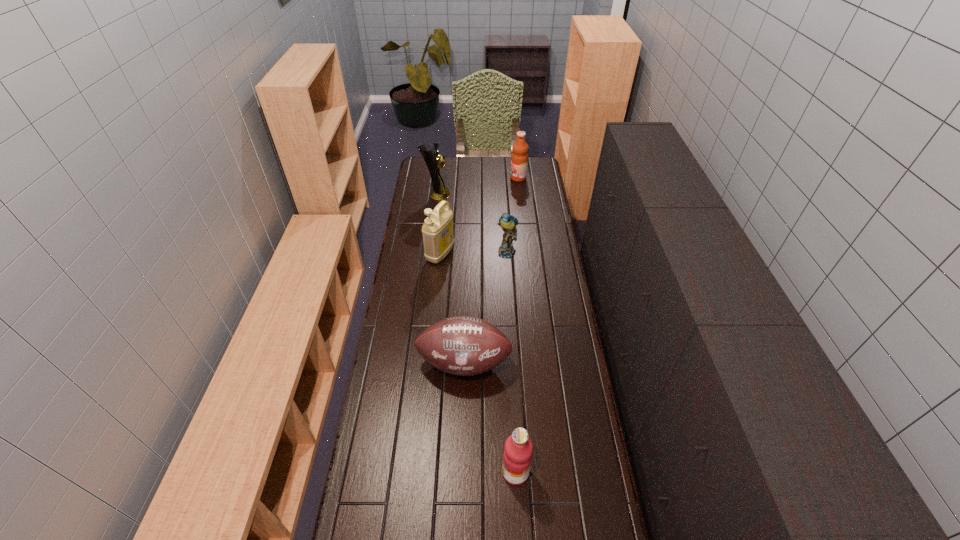
The image size is (960, 540). Identify the location of free location located on the front label of the farthest object. (470, 178).

Where is `vacant space located on the front label of the farthest object`? This screenshot has width=960, height=540. vacant space located on the front label of the farthest object is located at coordinates (457, 178).

Identify the location of free space located on the front label of the farthest object. The image size is (960, 540). (490, 178).

Where is `blank space located on the face of the parrot`? blank space located on the face of the parrot is located at coordinates (511, 314).

Find the location of a particular element. Image resolution: width=960 pixels, height=540 pixels. blank area located on the label of the left fruit juice is located at coordinates (398, 472).

Locate an element on the screen. free location located 0.310m on the label of the left fruit juice is located at coordinates (402, 472).

You are a GUI agent. You are given a task and a screenshot of the screen. Output one action in this format:
    pyautogui.click(x=<x>, y=<y>)
    Task: Click on the vacant space located on the label of the left fruit juice
    This screenshot has width=960, height=540.
    Given the screenshot: What is the action you would take?
    pyautogui.click(x=409, y=472)

Identify the location of vacant space situated on the back of the second nearest object. This screenshot has width=960, height=540. (466, 303).

Locate an element on the screen. The image size is (960, 540). object at the far edge is located at coordinates (519, 159).

I want to click on award present at the left edge, so click(432, 157).